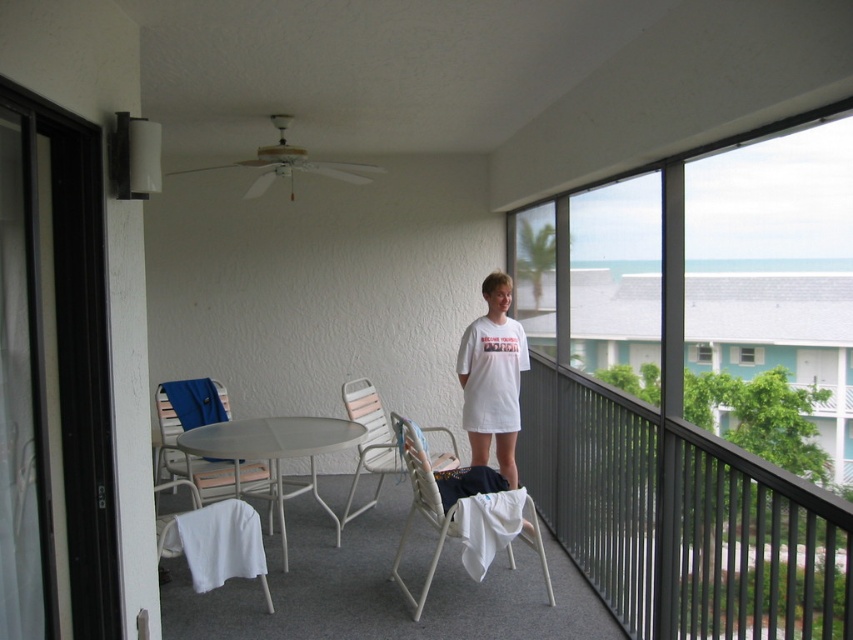
Question: Is white plastic chair at lower center below white plastic chair at center?

Choices:
 (A) no
 (B) yes

Answer: (B)

Question: Considering the real-world distances, which object is closest to the white plastic chair at lower left?

Choices:
 (A) white plastic chair at center
 (B) white metal table at center
 (C) white plastic chairs at center

Answer: (B)

Question: Is white plastic chair at lower left smaller than white plastic chair at center?

Choices:
 (A) yes
 (B) no

Answer: (B)

Question: Which object is closer to the camera taking this photo?

Choices:
 (A) white plastic chairs at center
 (B) white plastic chair at lower left
 (C) white plastic chair at center
 (D) white plastic chair at lower center

Answer: (A)

Question: Can you confirm if white plastic chair at lower center is wider than white plastic chair at center?

Choices:
 (A) yes
 (B) no

Answer: (B)

Question: Which point appears closest to the camera in this image?

Choices:
 (A) (253, 572)
 (B) (509, 534)
 (C) (297, 433)
 (D) (601, 448)

Answer: (A)